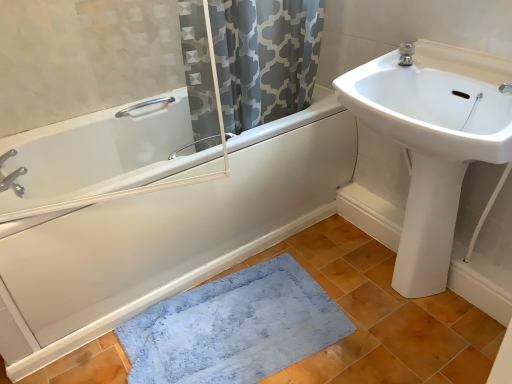
I want to click on vacant area situated below white glossy bidet at right (from a real-world perspective), so click(x=403, y=296).